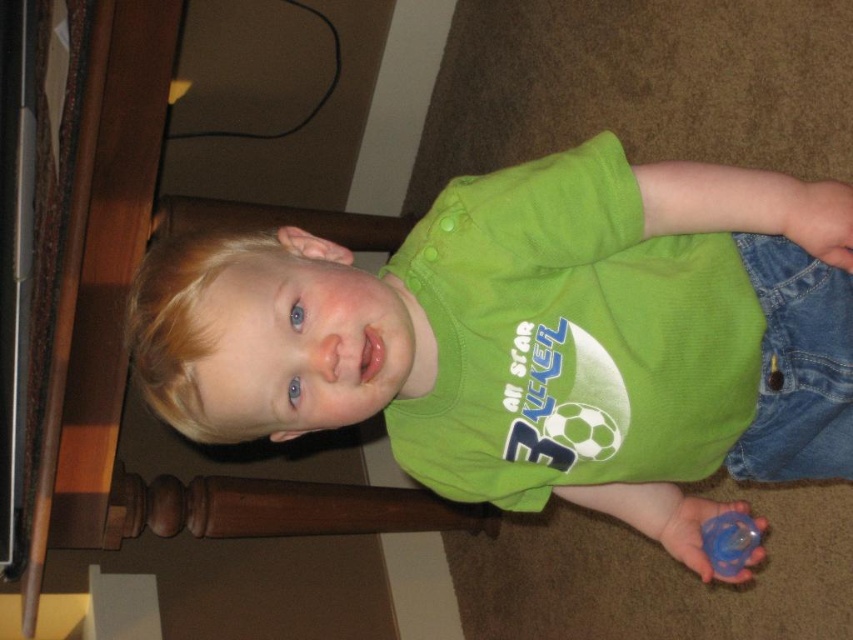
Does green matte shirt at center have a lesser width compared to blue rubber pacifier at lower right?

No.

From the picture: Between green matte shirt at center and blue rubber pacifier at lower right, which one has more height?

With more height is green matte shirt at center.

Is point (163, 336) more distant than point (732, 513)?

No.

Locate an element on the screen. The image size is (853, 640). green matte shirt at center is located at coordinates (537, 337).